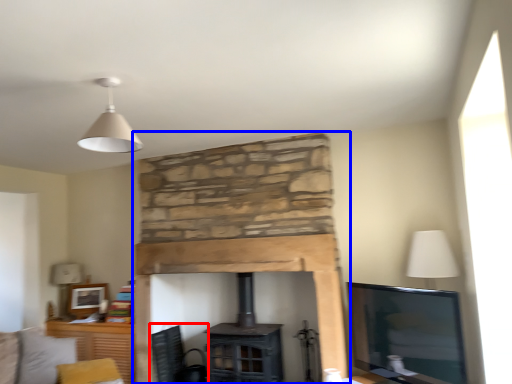
Question: Among these objects, which one is farthest to the camera, swivel chair (highlighted by a red box) or fireplace (highlighted by a blue box)?

Choices:
 (A) swivel chair
 (B) fireplace

Answer: (A)